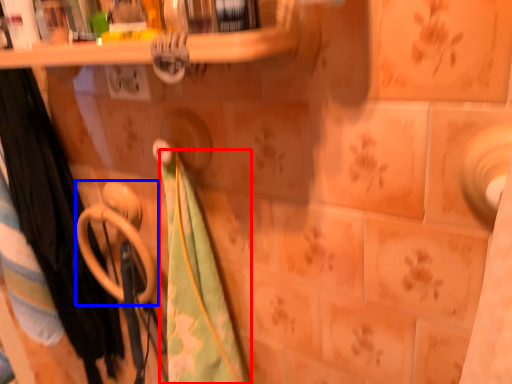
Question: Which of the following is the closest to the observer, beach towel (highlighted by a red box) or towel rack (highlighted by a blue box)?

Choices:
 (A) beach towel
 (B) towel rack

Answer: (A)